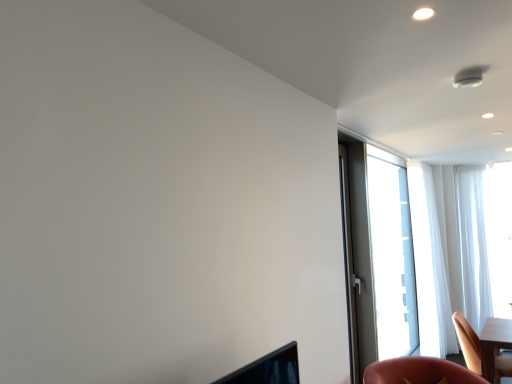
Question: Is the depth of wooden chair at lower right less than that of transparent glass window at right?

Choices:
 (A) no
 (B) yes

Answer: (B)

Question: From a real-world perspective, is wooden chair at lower right physically above transparent glass window at right?

Choices:
 (A) yes
 (B) no

Answer: (B)

Question: Is wooden chair at lower right to the left of transparent glass window at right from the viewer's perspective?

Choices:
 (A) yes
 (B) no

Answer: (B)

Question: Does wooden chair at lower right have a larger size compared to transparent glass window at right?

Choices:
 (A) yes
 (B) no

Answer: (B)

Question: Is wooden chair at lower right touching transparent glass window at right?

Choices:
 (A) yes
 (B) no

Answer: (B)

Question: From their relative heights in the image, would you say matte gray screen door at right is taller or shorter than white sheer curtain at right, positioned as the second curtain in left-to-right order?

Choices:
 (A) tall
 (B) short

Answer: (B)

Question: Would you say matte gray screen door at right is to the left or to the right of white sheer curtain at right, positioned as the second curtain in left-to-right order, in the picture?

Choices:
 (A) left
 (B) right

Answer: (A)

Question: From the image's perspective, relative to white sheer curtain at right, positioned as the second curtain in left-to-right order, is matte gray screen door at right above or below?

Choices:
 (A) below
 (B) above

Answer: (B)

Question: Considering the positions of matte gray screen door at right and white sheer curtain at right, positioned as the second curtain in left-to-right order, in the image, is matte gray screen door at right bigger or smaller than white sheer curtain at right, positioned as the second curtain in left-to-right order,?

Choices:
 (A) big
 (B) small

Answer: (B)

Question: From the image's perspective, is transparent glass window at right located above or below matte gray screen door at right?

Choices:
 (A) below
 (B) above

Answer: (A)

Question: Is point (358, 292) positioned closer to the camera than point (367, 225)?

Choices:
 (A) closer
 (B) farther

Answer: (A)

Question: Considering the positions of transparent glass window at right and matte gray screen door at right in the image, is transparent glass window at right taller or shorter than matte gray screen door at right?

Choices:
 (A) tall
 (B) short

Answer: (A)

Question: In terms of width, does transparent glass window at right look wider or thinner when compared to matte gray screen door at right?

Choices:
 (A) wide
 (B) thin

Answer: (B)

Question: Is white sheer curtain at right, which is counted as the 1th curtain, starting from the right, bigger or smaller than wooden chair at lower right?

Choices:
 (A) big
 (B) small

Answer: (A)

Question: Visually, is white sheer curtain at right, which is counted as the 1th curtain, starting from the right, positioned to the left or to the right of wooden chair at lower right?

Choices:
 (A) left
 (B) right

Answer: (B)